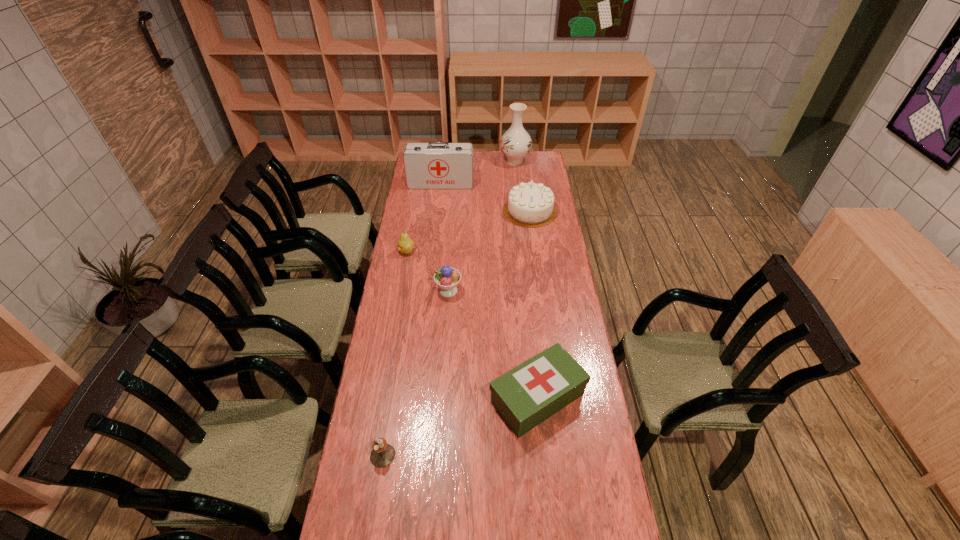
The height and width of the screenshot is (540, 960). I want to click on the tallest object, so click(516, 143).

You are a GUI agent. You are given a task and a screenshot of the screen. Output one action in this format:
    pyautogui.click(x=<x>, y=<y>)
    Task: Click on the farthest object
    The height and width of the screenshot is (540, 960).
    Given the screenshot: What is the action you would take?
    516,143

This screenshot has width=960, height=540. I want to click on the farther first-aid kit, so (x=435, y=165).

Locate an element on the screen. This screenshot has height=540, width=960. the second farthest object is located at coordinates (435, 165).

I want to click on birthday cake, so click(x=530, y=205).

Locate an element on the screen. The image size is (960, 540). icecream is located at coordinates (447, 278).

Locate an element on the screen. This screenshot has width=960, height=540. the fourth farthest object is located at coordinates 405,245.

You are a GUI agent. You are given a task and a screenshot of the screen. Output one action in this format:
    pyautogui.click(x=<x>, y=<y>)
    Task: Click on the nearer first-aid kit
    This screenshot has width=960, height=540.
    Given the screenshot: What is the action you would take?
    pyautogui.click(x=527, y=395)

The width and height of the screenshot is (960, 540). I want to click on the second nearest object, so click(527, 395).

Where is `the nearest object`? the nearest object is located at coordinates (382, 455).